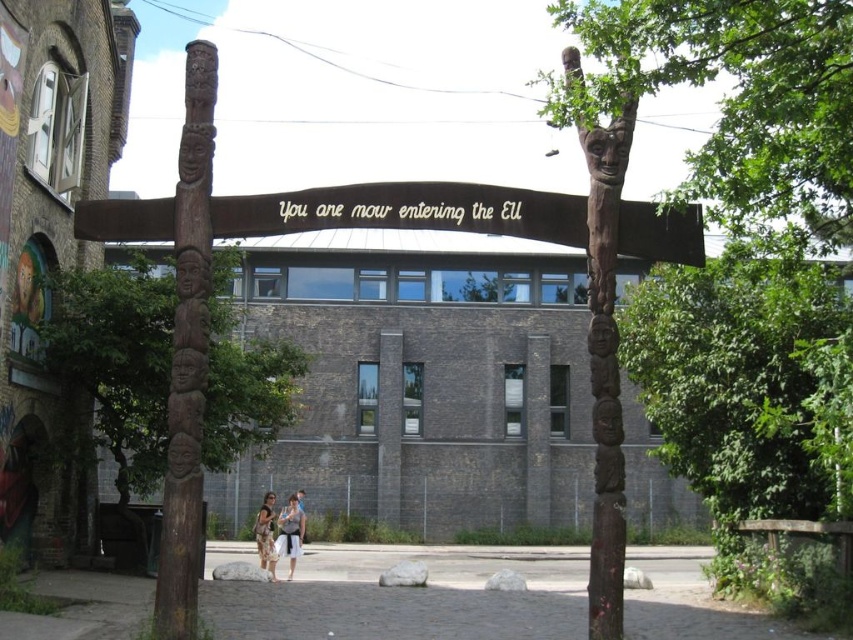
Between brown wooden sign at center and matte beige dress at center, which one is positioned lower?

Positioned lower is matte beige dress at center.

Does brown wooden sign at center appear under matte beige dress at center?

No.

Who is more distant from viewer, [624,250] or [283,516]?

The point [283,516] is behind.

Locate an element on the screen. brown wooden sign at center is located at coordinates (405, 211).

Who is taller, brown wooden sign at center or wooden totem pole at center?

wooden totem pole at center is taller.

Who is shorter, brown wooden sign at center or wooden totem pole at center?

brown wooden sign at center

Image resolution: width=853 pixels, height=640 pixels. What are the coordinates of `brown wooden sign at center` in the screenshot? It's located at (405, 211).

Is point (297, 552) more distant than point (259, 563)?

No, it is not.

Which is behind, point (267, 548) or point (260, 531)?

The point (260, 531) is behind.

The height and width of the screenshot is (640, 853). I want to click on matte beige dress at center, so click(277, 532).

Locate an element on the screen. The height and width of the screenshot is (640, 853). matte beige dress at center is located at coordinates (277, 532).